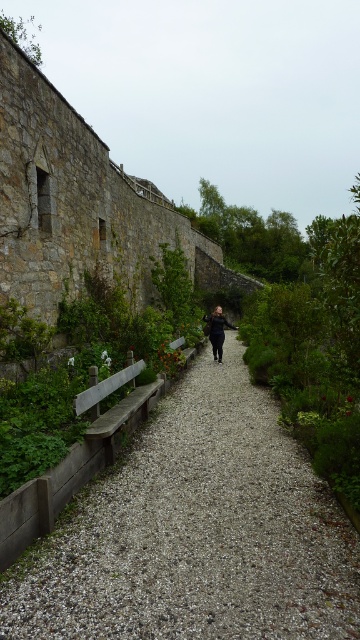
Question: Which point is closer to the camera?

Choices:
 (A) (156, 388)
 (B) (345, 605)
 (C) (203, 321)

Answer: (B)

Question: Based on their relative distances, which object is nearer to the gray gravel at center?

Choices:
 (A) wooden bench at left
 (B) black matte jacket at center

Answer: (A)

Question: Which of the following is the farthest from the observer?

Choices:
 (A) (47, 616)
 (B) (159, 388)

Answer: (B)

Question: Can you confirm if gray gravel at center is bigger than wooden bench at left?

Choices:
 (A) no
 (B) yes

Answer: (B)

Question: Can you confirm if wooden bench at left is positioned below black matte jacket at center?

Choices:
 (A) yes
 (B) no

Answer: (A)

Question: Does gray gravel at center have a greater width compared to black matte jacket at center?

Choices:
 (A) no
 (B) yes

Answer: (B)